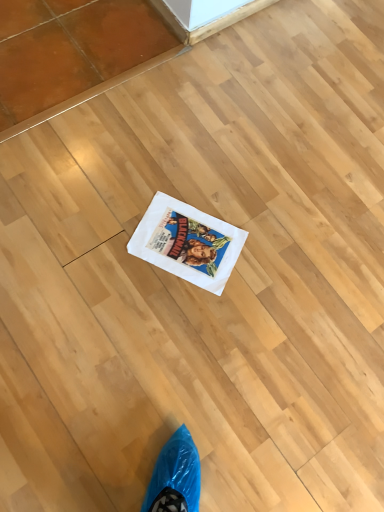
I want to click on white paper comic book at center, so click(x=187, y=243).

Image resolution: width=384 pixels, height=512 pixels. What do you see at coordinates (187, 243) in the screenshot?
I see `white paper comic book at center` at bounding box center [187, 243].

Measure the distance between white paper comic book at center and camera.

1.17 meters.

This screenshot has width=384, height=512. In order to click on white paper comic book at center in this screenshot , I will do `click(187, 243)`.